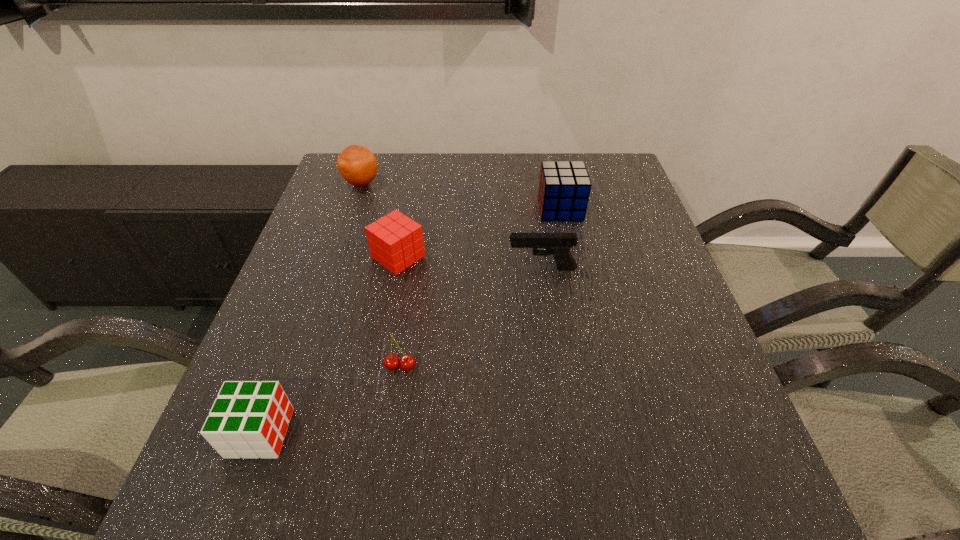
Find the location of a particular element. the farthest object is located at coordinates (358, 166).

Where is `the tallest cube`? This screenshot has width=960, height=540. the tallest cube is located at coordinates (564, 188).

Identify the location of the fifth nearest object. This screenshot has width=960, height=540. (564, 188).

Locate an element on the screen. The image size is (960, 540). pistol is located at coordinates (558, 244).

The width and height of the screenshot is (960, 540). Identify the location of the second nearest cube. (395, 241).

In order to click on the nearest cube in this screenshot , I will do `click(249, 419)`.

At what (x,y) coordinates should I click in order to perform the action: click on the leftmost cube. Please return your answer as a coordinate pair (x, y). Looking at the image, I should click on (249, 419).

Find the location of a particular element. This screenshot has height=540, width=960. cherry is located at coordinates (391, 362).

What are the coordinates of `vacant space situated on the front of the farthest object` in the screenshot? It's located at (347, 227).

Where is `free space located 0.170m on the back of the tallest cube`? free space located 0.170m on the back of the tallest cube is located at coordinates (551, 166).